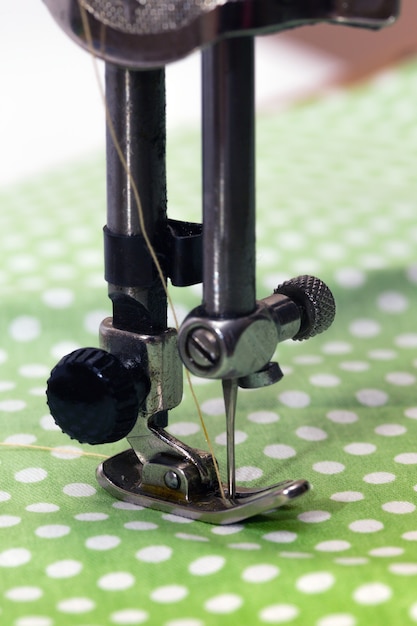
Identify the location of knob. (98, 403).